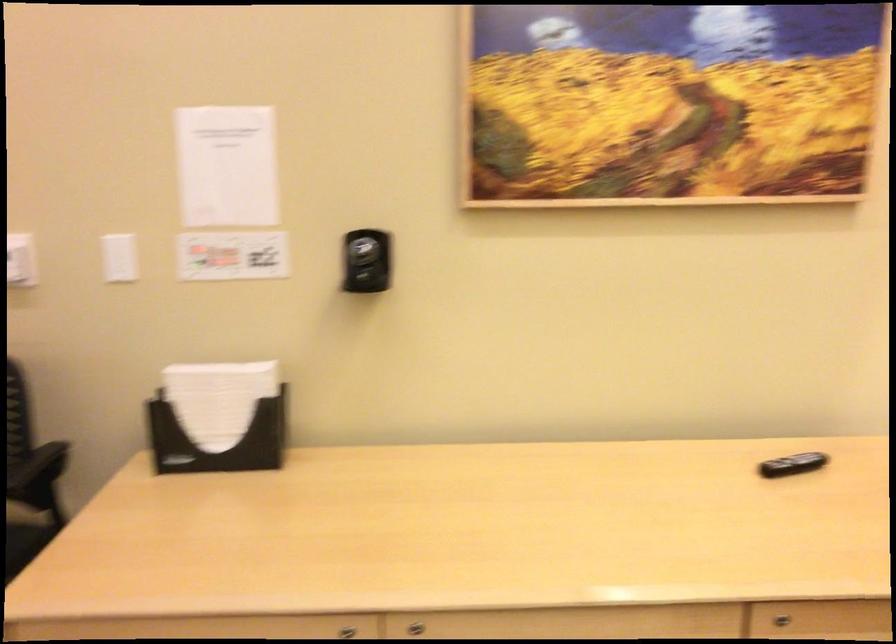
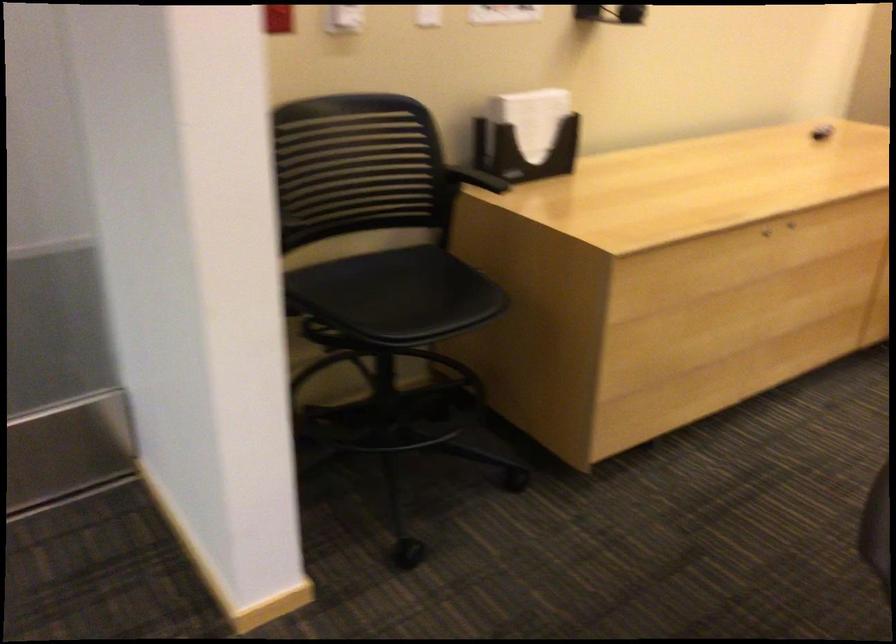
Find the pixel in the second image that matches [214,404] in the first image.

(531, 118)